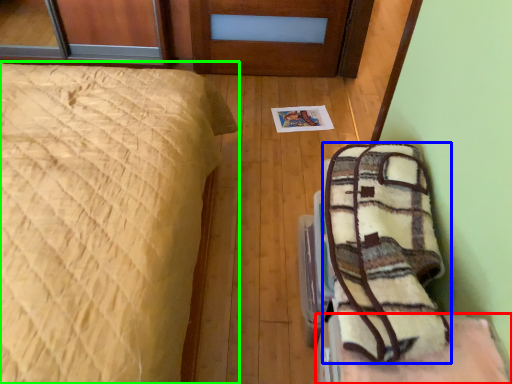
Question: Which object is the farthest from furniture (highlighted by a red box)? Choose among these: blanket (highlighted by a blue box) or bed (highlighted by a green box).

Choices:
 (A) blanket
 (B) bed

Answer: (B)